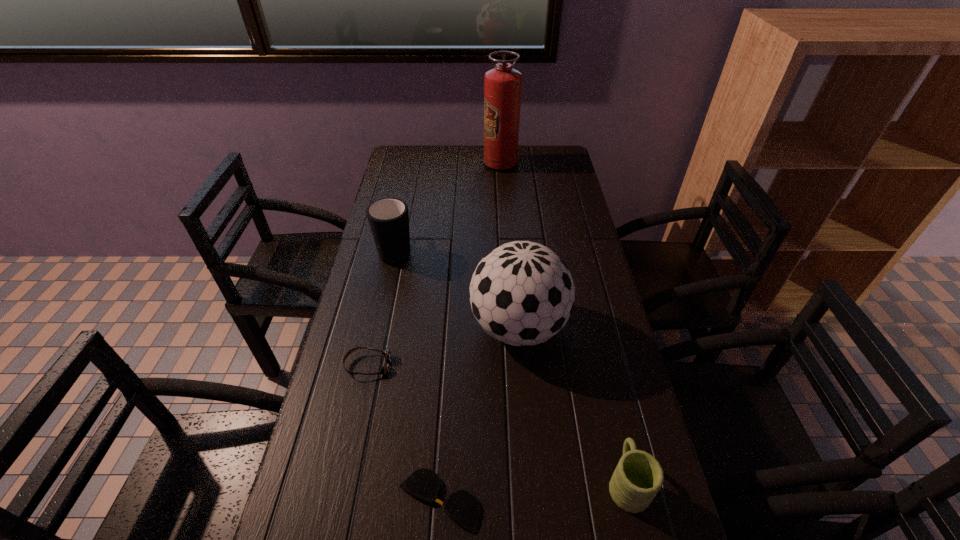
Identify the location of vacant position located on the back of the shortest object. Image resolution: width=960 pixels, height=540 pixels. (446, 383).

I want to click on object that is at the far edge, so click(x=502, y=85).

Where is `mug at the left edge`? mug at the left edge is located at coordinates (388, 218).

This screenshot has width=960, height=540. In order to click on goggles situated at the left edge in this screenshot , I will do `click(387, 354)`.

Locate an element on the screen. This screenshot has height=540, width=960. soccer ball positioned at the right edge is located at coordinates (521, 293).

The height and width of the screenshot is (540, 960). In order to click on mug that is at the right edge in this screenshot , I will do `click(638, 477)`.

Image resolution: width=960 pixels, height=540 pixels. In the image, there is a desktop. Find the location of `vacant space at the far edge`. vacant space at the far edge is located at coordinates (448, 151).

Image resolution: width=960 pixels, height=540 pixels. In the image, there is a desktop. What are the coordinates of `vacant space at the left edge` in the screenshot? It's located at [x=362, y=505].

The image size is (960, 540). In order to click on vacant region at the right edge in this screenshot , I will do `click(547, 222)`.

This screenshot has height=540, width=960. Identify the location of free space at the far left corner of the desktop. (428, 146).